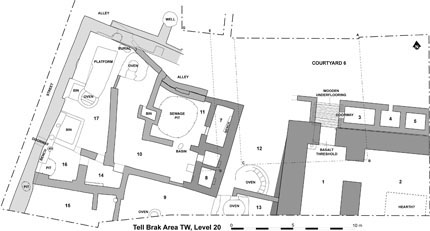
Find the location of a particular element. room 2 is located at coordinates (398, 183).